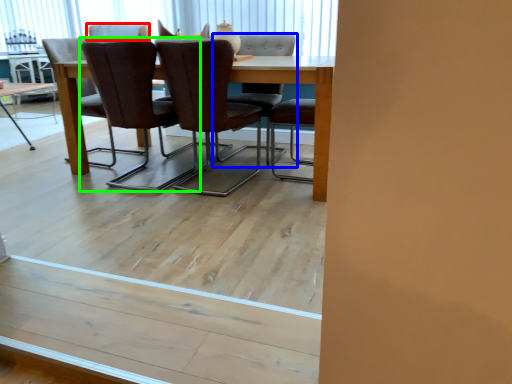
Question: Estimate the real-world distances between objects in this image. Which object is closer to chair (highlighted by a red box), chair (highlighted by a blue box) or chair (highlighted by a green box)?

Choices:
 (A) chair
 (B) chair

Answer: (B)